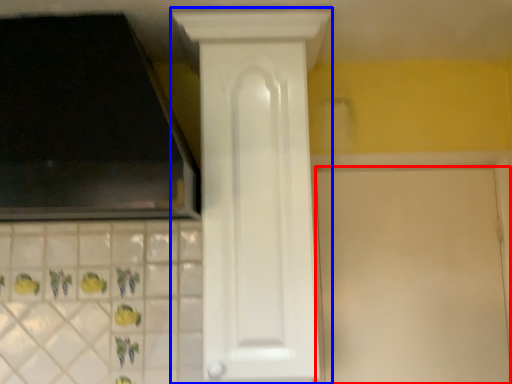
Question: Which object appears farthest to the camera in this image, door (highlighted by a red box) or door (highlighted by a blue box)?

Choices:
 (A) door
 (B) door

Answer: (A)